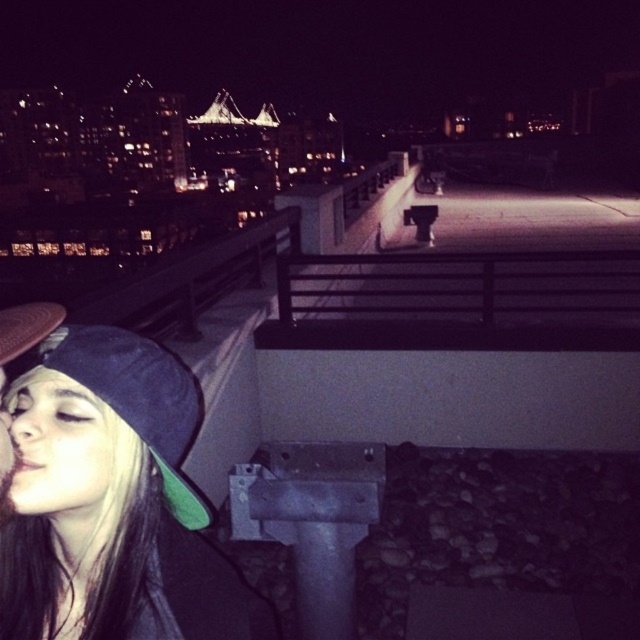
Question: Observing the image, what is the correct spatial positioning of black matte cap at lower left in reference to matte black cap at lower left?

Choices:
 (A) right
 (B) left

Answer: (A)

Question: Which point is farther from the camera taking this photo?

Choices:
 (A) (204, 625)
 (B) (8, 358)

Answer: (A)

Question: Which of the following is the closest to the observer?

Choices:
 (A) matte black cap at lower left
 (B) black matte cap at lower left

Answer: (A)

Question: Among these objects, which one is farthest from the camera?

Choices:
 (A) matte black cap at lower left
 (B) black matte cap at lower left

Answer: (B)

Question: Is black matte cap at lower left in front of matte black cap at lower left?

Choices:
 (A) yes
 (B) no

Answer: (B)

Question: Is black matte cap at lower left wider than matte black cap at lower left?

Choices:
 (A) no
 (B) yes

Answer: (A)